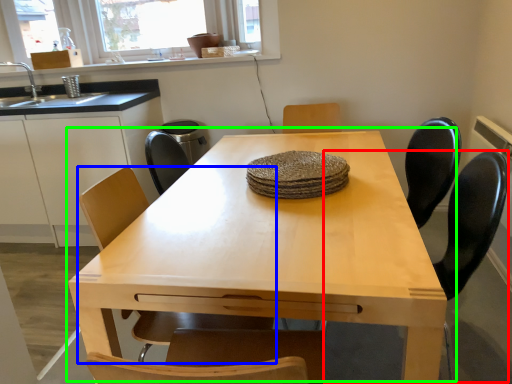
Question: Based on their relative distances, which object is nearer to swivel chair (highlighted by a red box)? Choose from chair (highlighted by a blue box) and table (highlighted by a green box).

Choices:
 (A) chair
 (B) table

Answer: (B)